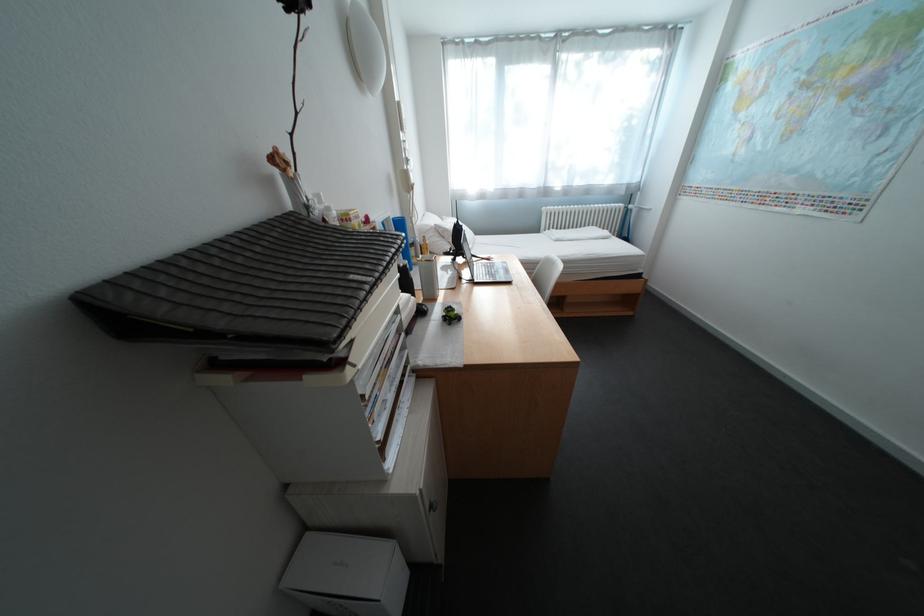
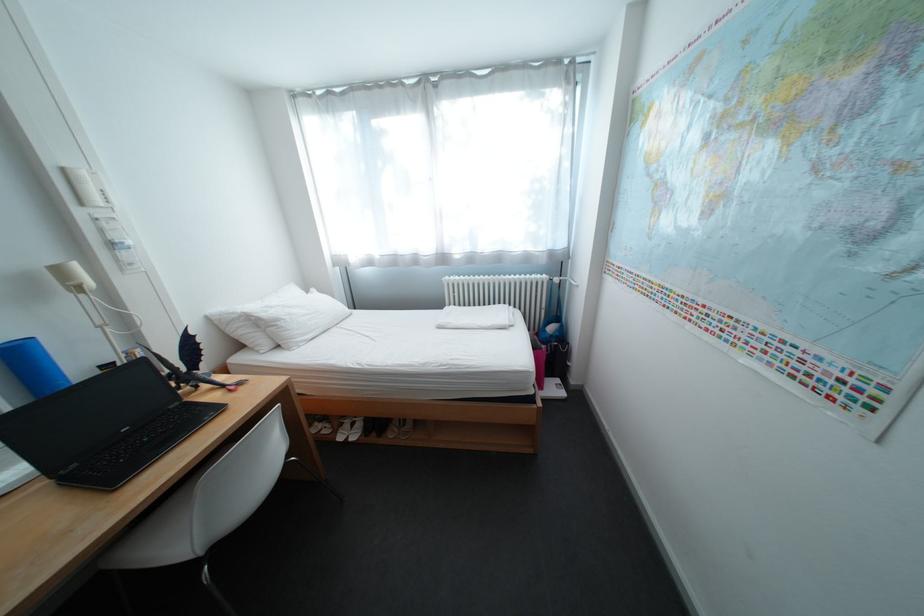
Find the pixel in the second image that matches (411,105) in the first image.

(76, 171)